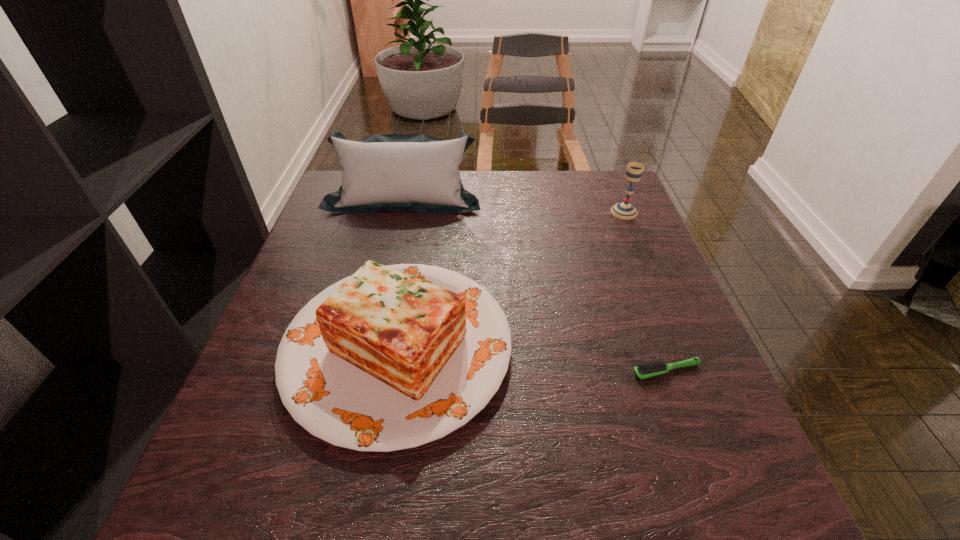
In order to click on cushion located at the left edge in this screenshot , I will do `click(413, 172)`.

You are a GUI agent. You are given a task and a screenshot of the screen. Output one action in this format:
    pyautogui.click(x=<x>, y=<y>)
    Task: Click on the lasagna present at the left edge
    
    Given the screenshot: What is the action you would take?
    392,357

Locate an element on the screen. chalice located at the right edge is located at coordinates (624, 210).

You are a GUI agent. You are given a task and a screenshot of the screen. Output one action in this format:
    pyautogui.click(x=<x>, y=<y>)
    Task: Click on the hairbrush present at the right edge
    This screenshot has height=540, width=960.
    Given the screenshot: What is the action you would take?
    pos(652,369)

At what (x,y) coordinates should I click in order to perform the action: click on object that is at the far left corner. Please return your answer as a coordinate pair (x, y). The image size is (960, 540). Looking at the image, I should click on (413, 172).

Locate an element on the screen. This screenshot has height=540, width=960. object present at the far right corner is located at coordinates (624, 210).

Where is `vacant space at the far edge of the desktop`? This screenshot has height=540, width=960. vacant space at the far edge of the desktop is located at coordinates (569, 200).

Where is `vacant region at the near edge of the desktop`? The image size is (960, 540). vacant region at the near edge of the desktop is located at coordinates (498, 493).

Locate an element on the screen. blank area at the left edge is located at coordinates coord(348,226).

Identify the location of vacant space at the right edge of the desktop. (713, 381).